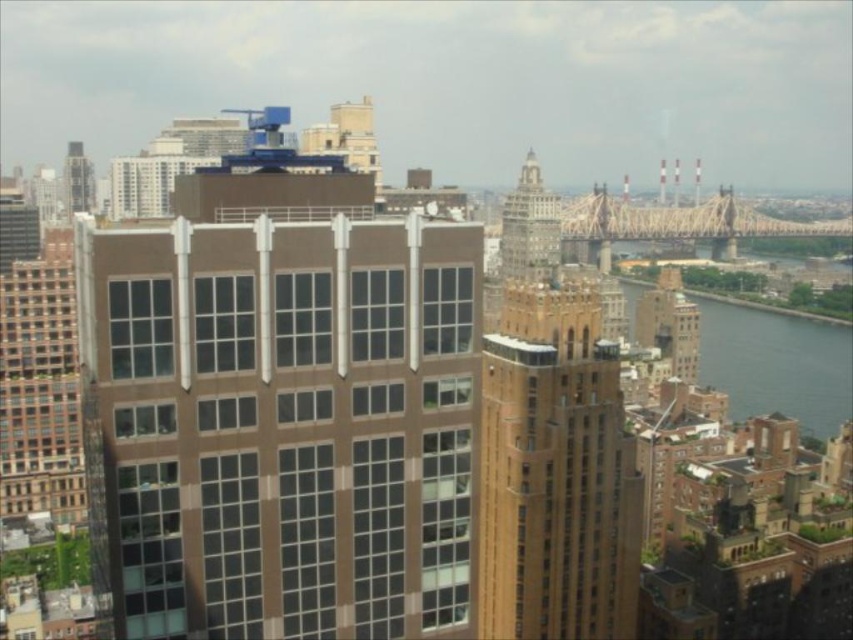
Question: In this image, where is brown brick building at center located relative to silver metallic tower at upper center?

Choices:
 (A) below
 (B) above

Answer: (A)

Question: Which point is farther from the camera taking this photo?

Choices:
 (A) (727, 388)
 (B) (585, 353)
 (C) (80, 157)

Answer: (C)

Question: Can you confirm if brown brick building at center is thinner than blue water at lower right?

Choices:
 (A) yes
 (B) no

Answer: (A)

Question: Which object is closer to the camera taking this photo?

Choices:
 (A) metallic silver tower at upper left
 (B) blue water at lower right

Answer: (B)

Question: Is blue water at lower right bigger than metallic silver tower at upper left?

Choices:
 (A) yes
 (B) no

Answer: (A)

Question: Which object is farther from the camera taking this photo?

Choices:
 (A) brown brick building at center
 (B) silver metallic tower at upper center
 (C) blue water at lower right
 (D) metallic silver tower at upper left

Answer: (D)